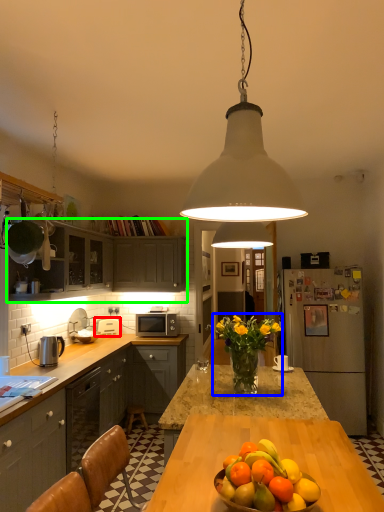
Question: Which is farther away from appliance (highlighted by a red box)? floral arrangement (highlighted by a blue box) or cabinetry (highlighted by a green box)?

Choices:
 (A) floral arrangement
 (B) cabinetry

Answer: (A)